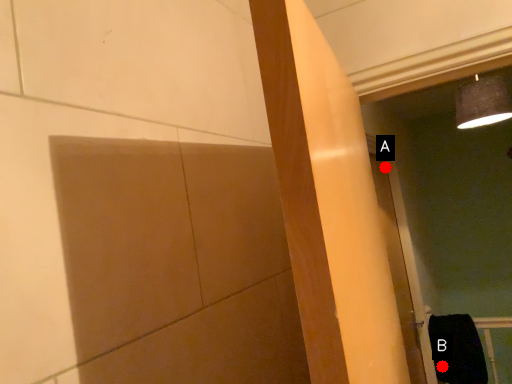
Question: Two points are circled on the image, labeled by A and B beside each circle. Among these points, which one is nearest to the camera?

Choices:
 (A) A is closer
 (B) B is closer

Answer: (A)